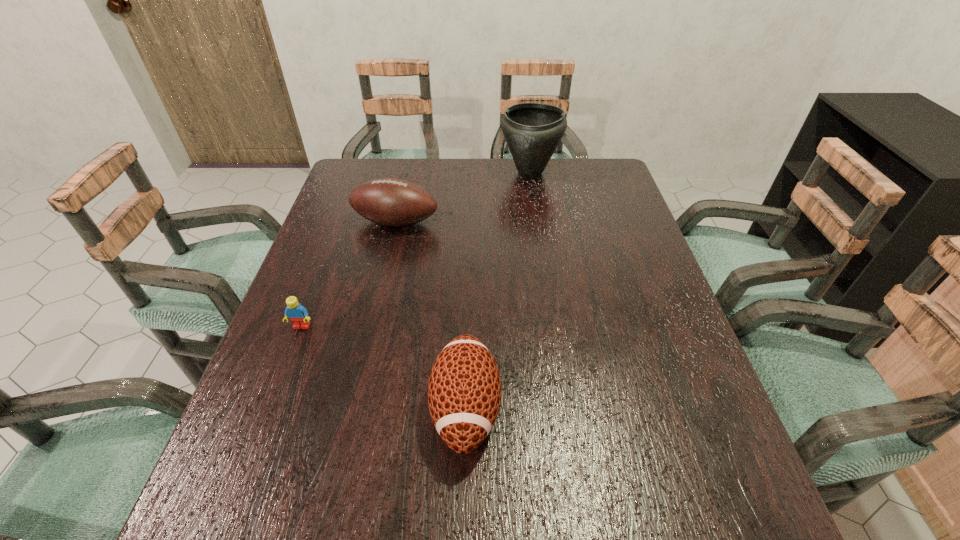
At what (x,y) coordinates should I click in order to perform the action: click on vacant space positioned on the back of the third object from left to right. Please return your answer as a coordinate pair (x, y). The height and width of the screenshot is (540, 960). Looking at the image, I should click on (468, 287).

Identify the location of free point located 0.100m on the face of the second nearest object. Image resolution: width=960 pixels, height=540 pixels. (286, 368).

Identify the location of object located in the far edge section of the desktop. The image size is (960, 540). (532, 131).

You are a GUI agent. You are given a task and a screenshot of the screen. Output one action in this format:
    pyautogui.click(x=<x>, y=<y>)
    Task: Click on the football (American) present at the left edge
    This screenshot has width=960, height=540.
    Given the screenshot: What is the action you would take?
    pyautogui.click(x=392, y=202)

Where is `Lego present at the left edge`? The image size is (960, 540). Lego present at the left edge is located at coordinates (298, 315).

The image size is (960, 540). Identify the location of vacant space at the far edge of the desktop. (521, 181).

In the image, there is a desktop. Where is `vacant area at the left edge`? vacant area at the left edge is located at coordinates (303, 461).

What are the coordinates of `free space at the right edge of the desktop` in the screenshot? It's located at (696, 398).

You are a GUI agent. You are given a task and a screenshot of the screen. Output one action in this format:
    pyautogui.click(x=<x>, y=<y>)
    Task: Click on the vacant space at the far left corner of the desktop
    This screenshot has height=540, width=960.
    Given the screenshot: What is the action you would take?
    pyautogui.click(x=378, y=164)

Find the location of a particular element. The height and width of the screenshot is (540, 960). vacant region at the far right corner of the desktop is located at coordinates (589, 185).